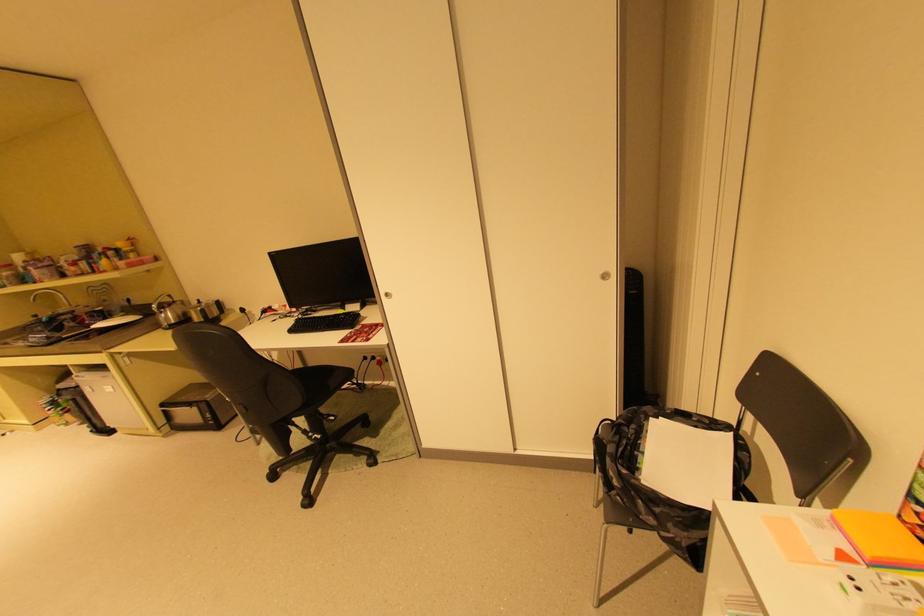
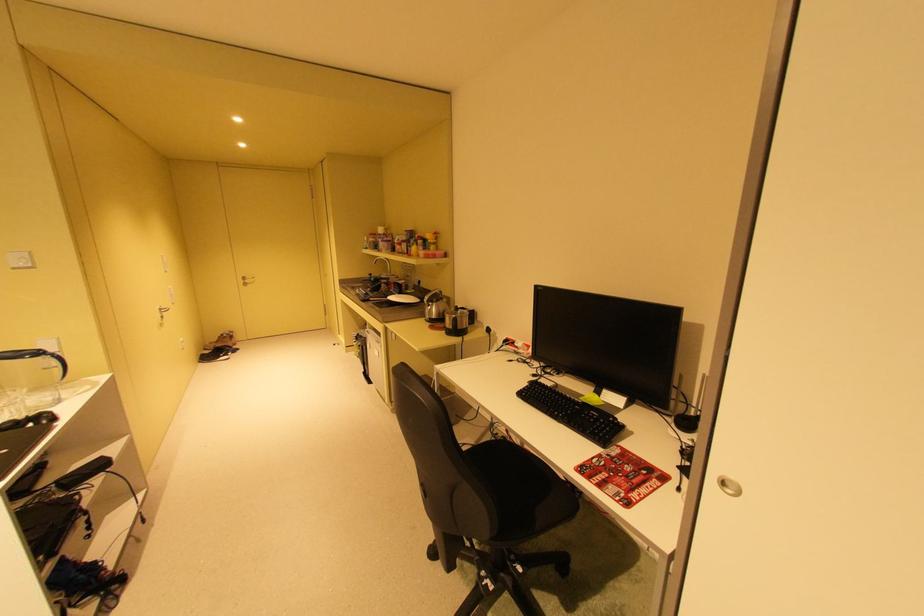
In the second image, find the point that corresponds to point (114, 249) in the first image.

(428, 237)